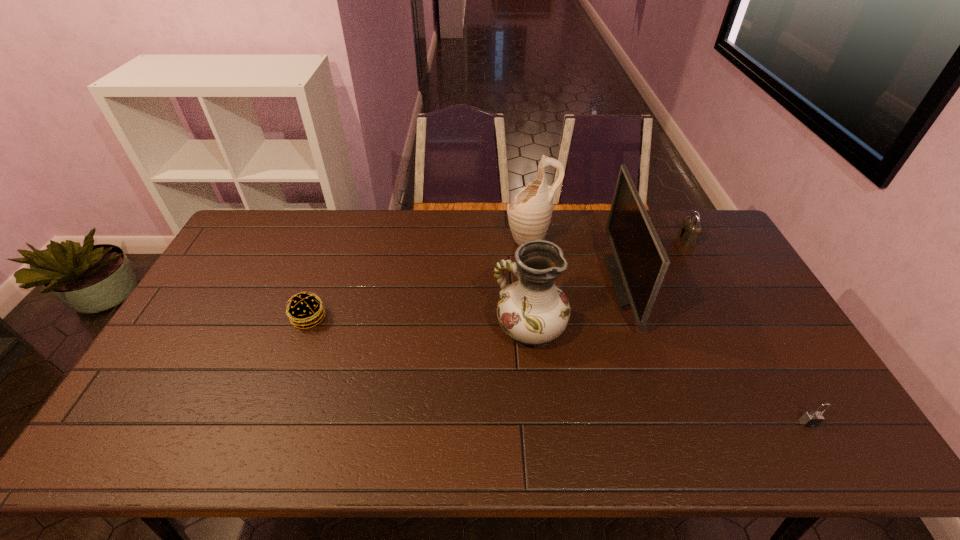
Locate an element on the screen. The height and width of the screenshot is (540, 960). vacant space that's between the leftmost object and the shorter padlock is located at coordinates (559, 370).

Identify the location of vacant region between the fifth object from left to right and the vase. This screenshot has height=540, width=960. (608, 284).

Locate an element on the screen. vacant area between the nearer padlock and the pitcher is located at coordinates (669, 331).

Find the location of a particular element. The width and height of the screenshot is (960, 540). vacant region between the taller padlock and the shorter padlock is located at coordinates (748, 331).

Identify the location of free space between the pitcher and the shorter padlock. (669, 331).

Identify the location of empty location between the vase and the leftmost object. The height and width of the screenshot is (540, 960). (419, 323).

Locate an element on the screen. The image size is (960, 540). vacant area that lies between the nearest object and the fifth object from left to right is located at coordinates (748, 331).

You are a GUI agent. You are given a task and a screenshot of the screen. Output one action in this format:
    pyautogui.click(x=<x>, y=<y>)
    Task: Click on the free space between the vase and the monitor
    
    Given the screenshot: What is the action you would take?
    pyautogui.click(x=578, y=306)

Select which object appears as the second closest to the pitcher. Please provide its 2D coordinates. Your answer should be formatted as a tuple, i.e. [(x, y)], where the tuple contains the x and y coordinates of a point satisfying the conditions above.

[(533, 311)]

Identify which object is located as the second nearest to the leftmost object. Please provide its 2D coordinates. Your answer should be formatted as a tuple, i.e. [(x, y)], where the tuple contains the x and y coordinates of a point satisfying the conditions above.

[(529, 215)]